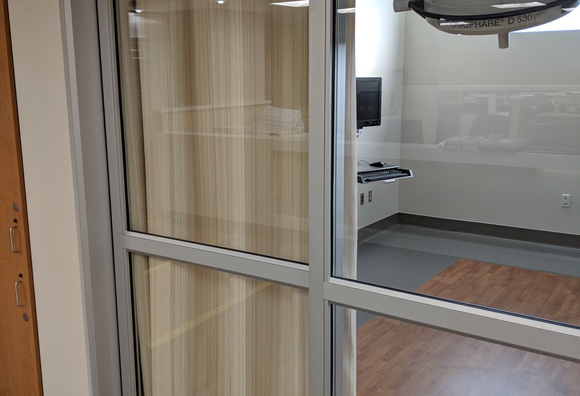
The image size is (580, 396). What are the coordinates of `metal window frame` in the screenshot? It's located at (105, 35), (126, 334), (227, 262), (322, 66), (319, 342), (437, 316), (554, 341).